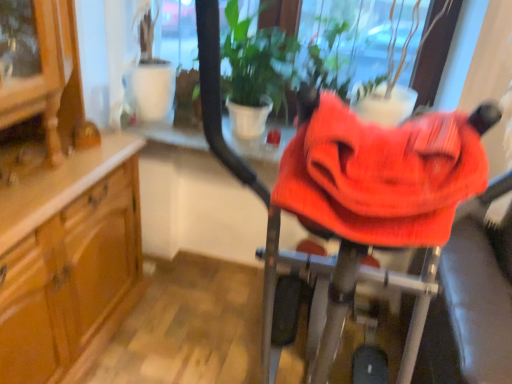
Measure the distance between point [325,347] and camera.

The depth of point [325,347] is 3.51 feet.

What is the approximate height of knitted fabric baby carriage at center?

knitted fabric baby carriage at center is 11.47 inches tall.

Locate an element on the screen. The height and width of the screenshot is (384, 512). knitted fabric baby carriage at center is located at coordinates (337, 296).

What do you see at coordinates (337, 296) in the screenshot? Image resolution: width=512 pixels, height=384 pixels. I see `knitted fabric baby carriage at center` at bounding box center [337, 296].

Identify the location of green leafy plant at center. The width and height of the screenshot is (512, 384). (256, 71).

Describe the element at coordinates (256, 71) in the screenshot. The image size is (512, 384). I see `green leafy plant at center` at that location.

This screenshot has height=384, width=512. I want to click on knitted fabric baby carriage at center, so click(337, 296).

Does knitted fabric baby carriage at center appear on the right side of green leafy plant at center?

Yes, knitted fabric baby carriage at center is to the right of green leafy plant at center.

Consider the image. Is knitted fabric baby carriage at center in front of or behind green leafy plant at center in the image?

Clearly, knitted fabric baby carriage at center is in front of green leafy plant at center.

Is point (344, 255) closer or farther from the camera than point (237, 135)?

Point (344, 255).

From the image's perspective, which is below, knitted fabric baby carriage at center or green leafy plant at center?

knitted fabric baby carriage at center is shown below in the image.

From a real-world perspective, is knitted fabric baby carriage at center above or below green leafy plant at center?

Clearly, from a real-world perspective, knitted fabric baby carriage at center is above green leafy plant at center.

Is knitted fabric baby carriage at center wider than green leafy plant at center?

No.

Does knitted fabric baby carriage at center have a lesser height compared to green leafy plant at center?

Correct, knitted fabric baby carriage at center is not as tall as green leafy plant at center.

Can you confirm if knitted fabric baby carriage at center is bigger than green leafy plant at center?

No.

Consider the image. Do you think knitted fabric baby carriage at center is within green leafy plant at center, or outside of it?

knitted fabric baby carriage at center cannot be found inside green leafy plant at center.

Is knitted fabric baby carriage at center beside green leafy plant at center?

knitted fabric baby carriage at center and green leafy plant at center are not in contact.

Could you tell me if knitted fabric baby carriage at center is turned towards green leafy plant at center?

No, knitted fabric baby carriage at center is not oriented towards green leafy plant at center.

The image size is (512, 384). In the image, there is a knitted fabric baby carriage at center. In order to click on houseplant below it (from a real-world perspective) in this screenshot , I will do `click(256, 71)`.

Is green leafy plant at center at the right side of knitted fabric baby carriage at center?

No.

In the image, is green leafy plant at center positioned in front of or behind knitted fabric baby carriage at center?

green leafy plant at center is positioned farther from the viewer than knitted fabric baby carriage at center.

Considering the points (252, 109) and (361, 268), which point is behind, point (252, 109) or point (361, 268)?

The point (252, 109) is behind.

Looking at this image, from the image's perspective, which one is positioned higher, green leafy plant at center or knitted fabric baby carriage at center?

green leafy plant at center is shown above in the image.

From a real-world perspective, between green leafy plant at center and knitted fabric baby carriage at center, who is vertically higher?

From a 3D spatial view, knitted fabric baby carriage at center is above.

Considering the sizes of green leafy plant at center and knitted fabric baby carriage at center in the image, is green leafy plant at center wider or thinner than knitted fabric baby carriage at center?

In the image, green leafy plant at center appears to be wider than knitted fabric baby carriage at center.

Is green leafy plant at center taller than knitted fabric baby carriage at center?

Correct, green leafy plant at center is much taller as knitted fabric baby carriage at center.

Is green leafy plant at center bigger than knitted fabric baby carriage at center?

Yes.

Is green leafy plant at center outside of knitted fabric baby carriage at center?

Yes.

Is green leafy plant at center not close to knitted fabric baby carriage at center?

No, green leafy plant at center is not far away from knitted fabric baby carriage at center.

Is green leafy plant at center oriented towards knitted fabric baby carriage at center?

Yes, green leafy plant at center faces towards knitted fabric baby carriage at center.

How many degrees apart are the facing directions of green leafy plant at center and knitted fabric baby carriage at center?

0.952 degrees.

How far apart are green leafy plant at center and knitted fabric baby carriage at center?

A distance of 34.65 inches exists between green leafy plant at center and knitted fabric baby carriage at center.

You are a GUI agent. You are given a task and a screenshot of the screen. Output one action in this format:
    pyautogui.click(x=<x>, y=<y>)
    Task: Click on the baby carriage on the right of green leafy plant at center
    
    Given the screenshot: What is the action you would take?
    pyautogui.click(x=337, y=296)

Locate an element on the screen. Image resolution: width=512 pixels, height=384 pixels. baby carriage in front of the green leafy plant at center is located at coordinates (337, 296).

Locate an element on the screen. houseplant lying on the left of knitted fabric baby carriage at center is located at coordinates (256, 71).